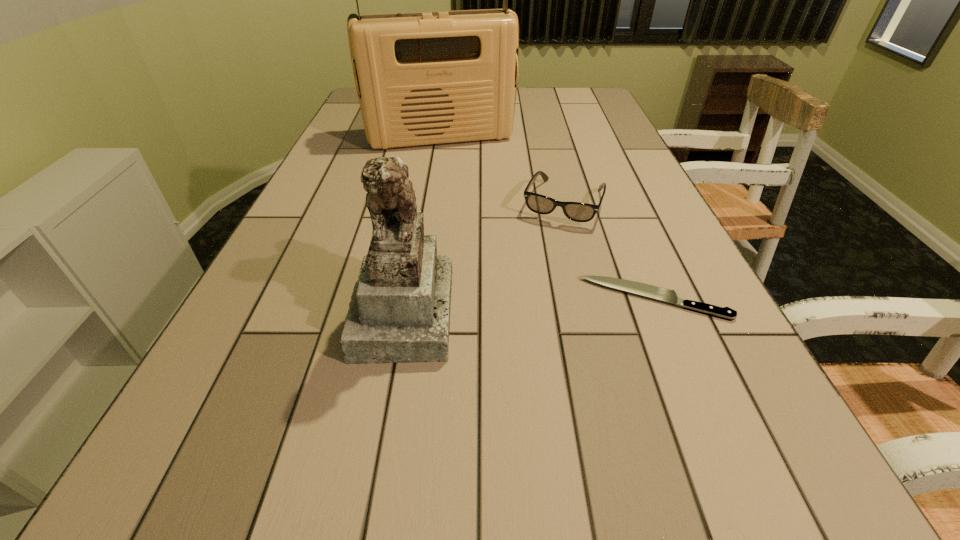
Where is `free spot on the desktop that is between the third shortest object and the shortest object and is positioned on the front-facing side of the tallest object`? The height and width of the screenshot is (540, 960). free spot on the desktop that is between the third shortest object and the shortest object and is positioned on the front-facing side of the tallest object is located at coordinates (493, 307).

The width and height of the screenshot is (960, 540). I want to click on vacant space on the desktop that is between the third shortest object and the shortest object and is positioned on the lenses of the second shortest object, so click(519, 306).